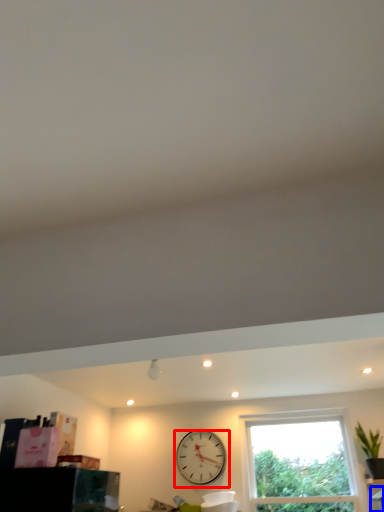
Question: Which point is further to the camera, wall clock (highlighted by a red box) or furniture (highlighted by a blue box)?

Choices:
 (A) wall clock
 (B) furniture

Answer: (A)